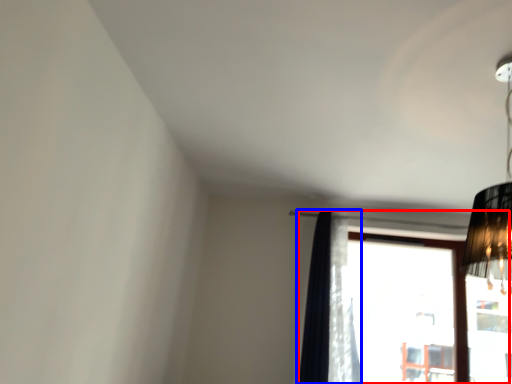
Question: Which of the following is the closest to the observer, window (highlighted by a red box) or curtain (highlighted by a blue box)?

Choices:
 (A) window
 (B) curtain

Answer: (B)